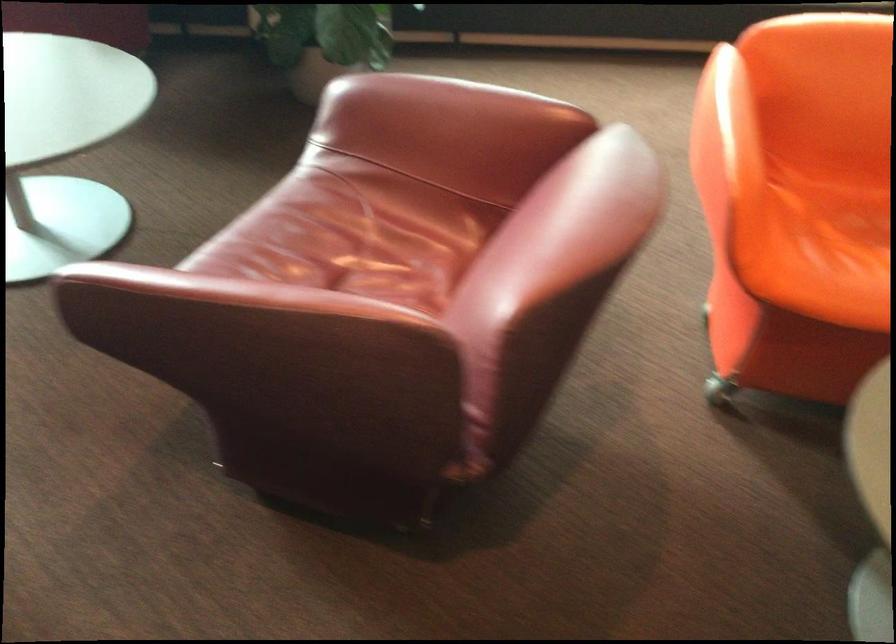
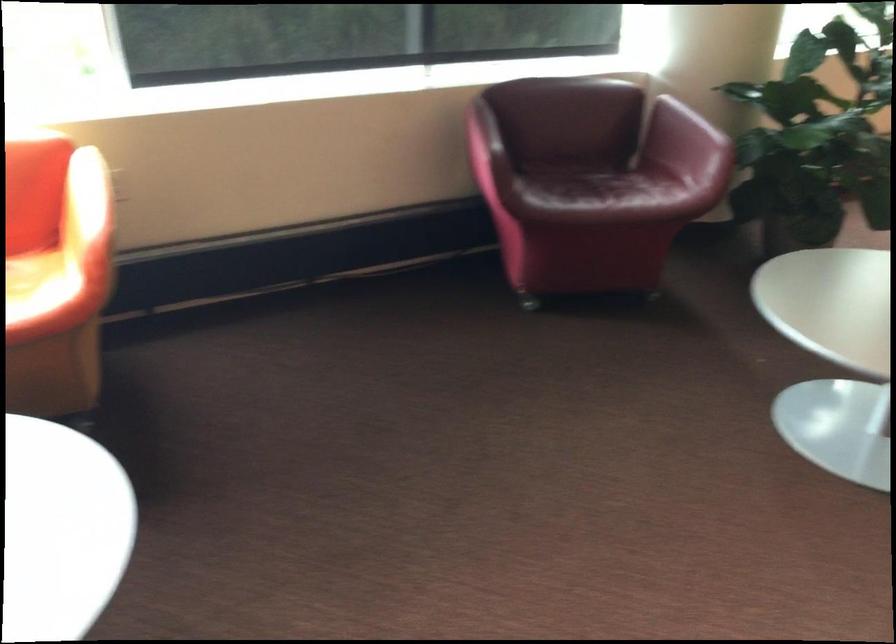
Question: The images are taken continuously from a first-person perspective. In which direction are you moving?

Choices:
 (A) Left
 (B) Right
 (C) Forward
 (D) Backward

Answer: (A)